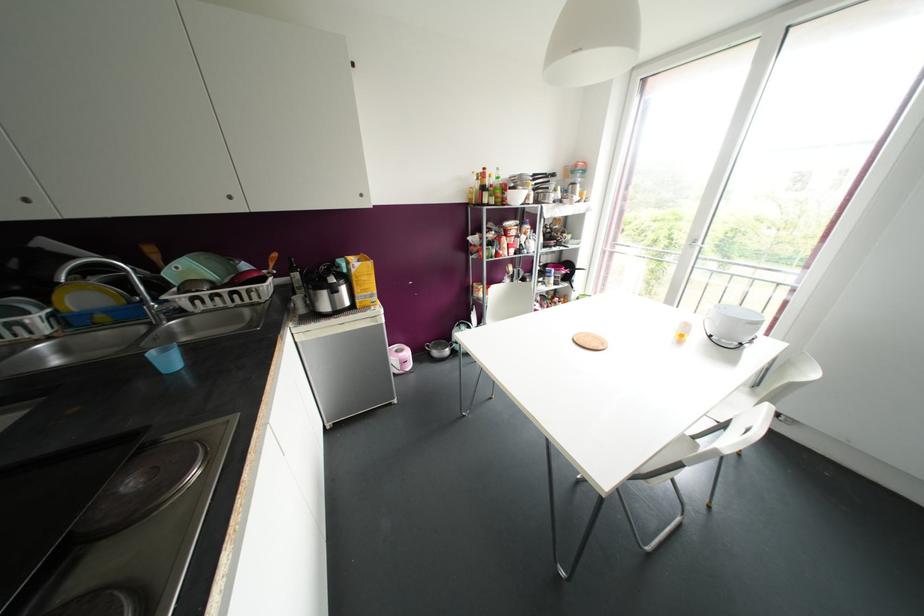
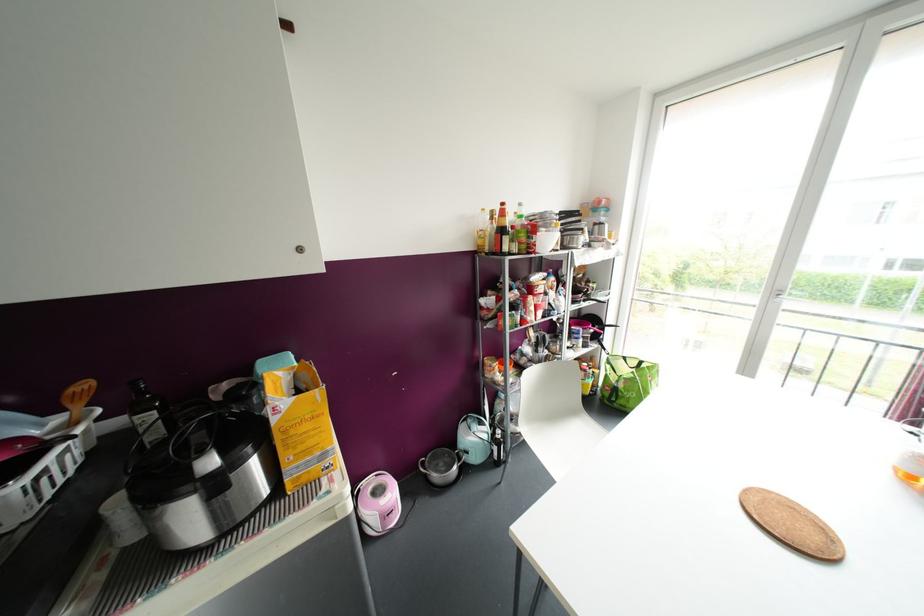
Question: The first image is from the beginning of the video and the second image is from the end. How did the camera likely rotate when shooting the video?

Choices:
 (A) Left
 (B) Right
 (C) Up
 (D) Down

Answer: (C)